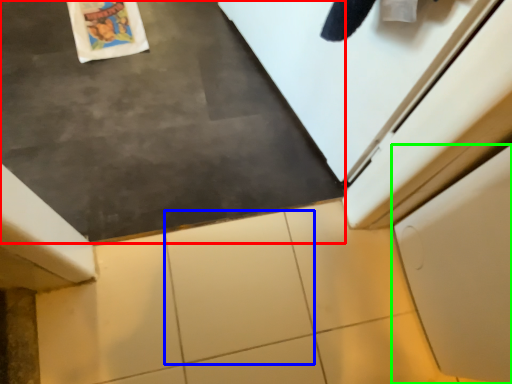
Question: Which object is positioned closest to slate (highlighted by a red box)? Select from granite (highlighted by a blue box) and cabinetry (highlighted by a green box).

Choices:
 (A) granite
 (B) cabinetry

Answer: (A)